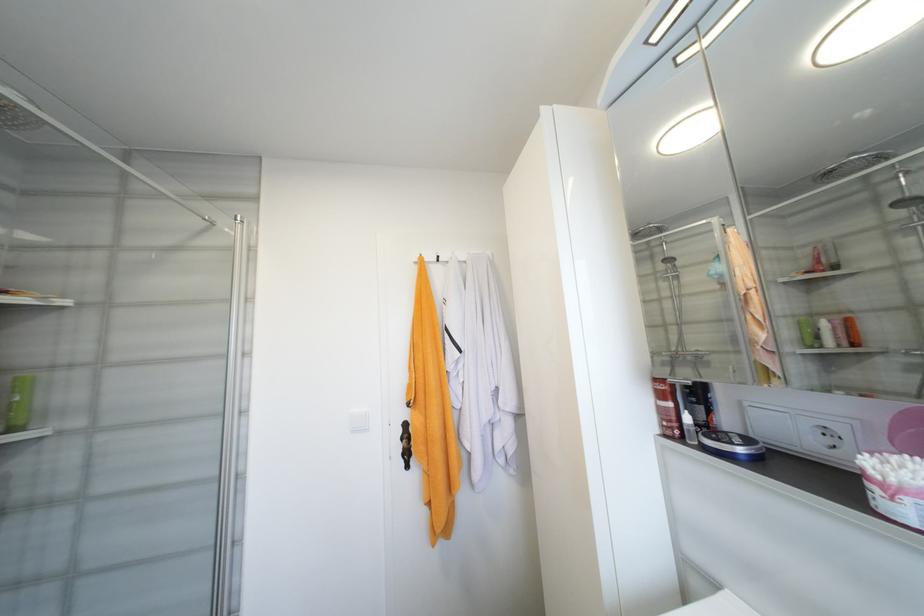
Identify the location of white wall hook. The height and width of the screenshot is (616, 924). (436, 257).